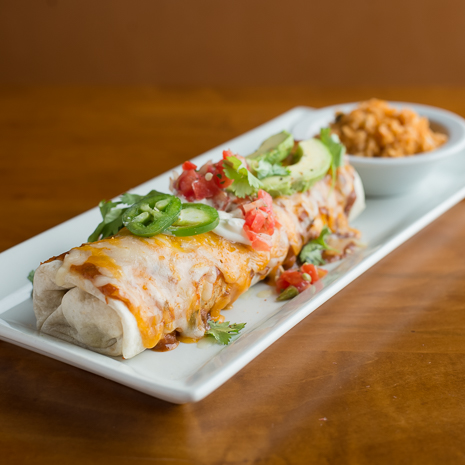
This screenshot has height=465, width=465. I want to click on white ceramic plate, so click(263, 329).